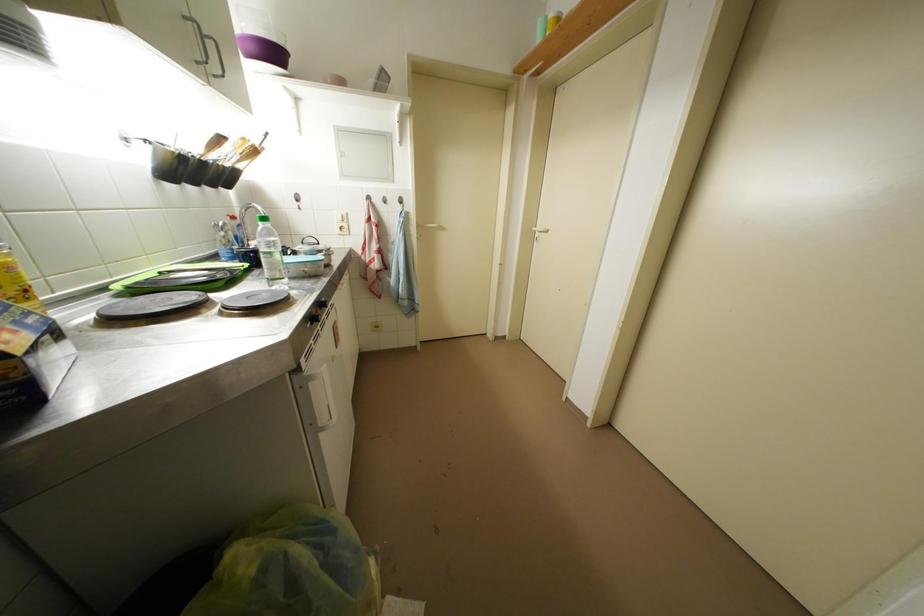
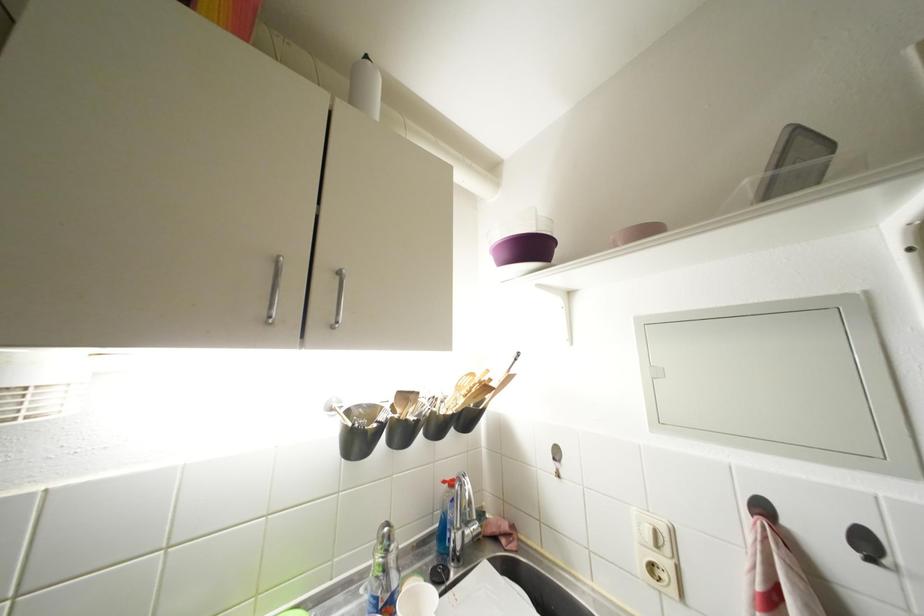
The point at (375, 203) is marked in the first image. Where is the corresponding point in the second image?

(770, 513)